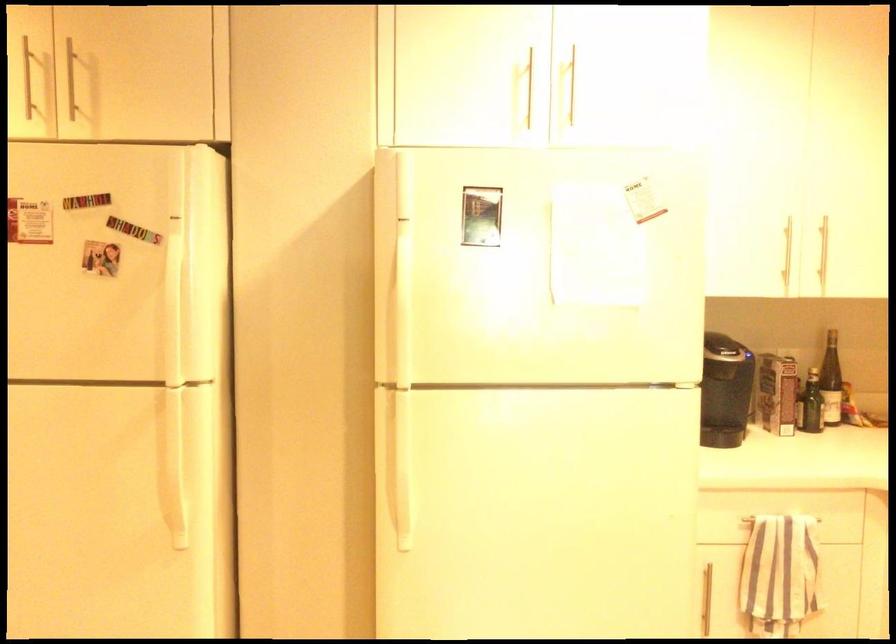
At what (x,y) coordinates should I click in order to perform the action: click on towel bar. Please return your answer as a coordinate pair (x, y). The image size is (896, 644). Looking at the image, I should click on (781, 518).